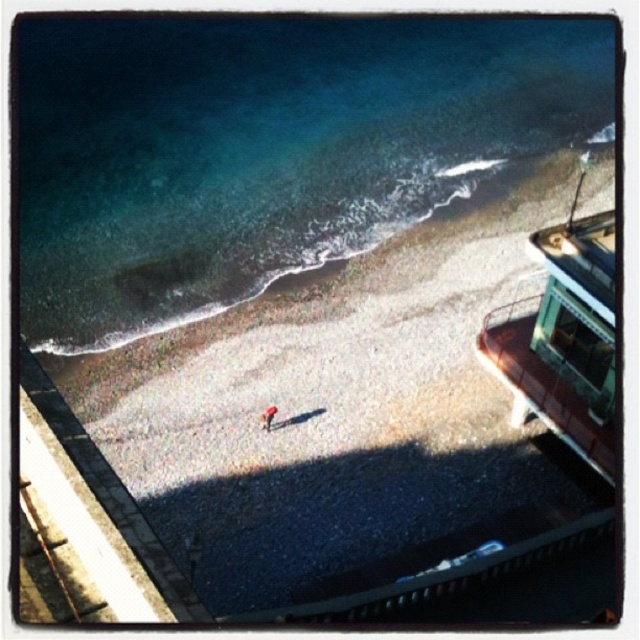
Based on the photo, does gray gravelly sand at center appear over metallic green boat at right?

No.

Can you confirm if gray gravelly sand at center is positioned to the right of metallic green boat at right?

Incorrect, gray gravelly sand at center is not on the right side of metallic green boat at right.

The height and width of the screenshot is (640, 640). What do you see at coordinates (378, 401) in the screenshot?
I see `gray gravelly sand at center` at bounding box center [378, 401].

The width and height of the screenshot is (640, 640). I want to click on gray gravelly sand at center, so click(x=378, y=401).

Is metallic green boat at right wider than light brown fabric jacket at center?

Correct, the width of metallic green boat at right exceeds that of light brown fabric jacket at center.

Consider the image. Between metallic green boat at right and light brown fabric jacket at center, which one is positioned lower?

light brown fabric jacket at center is below.

Who is more distant from viewer, (586, 444) or (260, 413)?

Point (260, 413)

I want to click on metallic green boat at right, so click(564, 337).

Is gray gravelly sand at center smaller than clear blue water at upper left?

Correct, gray gravelly sand at center occupies less space than clear blue water at upper left.

Is point (333, 486) positioned behind point (218, 172)?

That is False.

Is point (374, 538) closer to viewer compared to point (460, 145)?

Yes, it is.

The image size is (640, 640). Identify the location of gray gravelly sand at center. (378, 401).